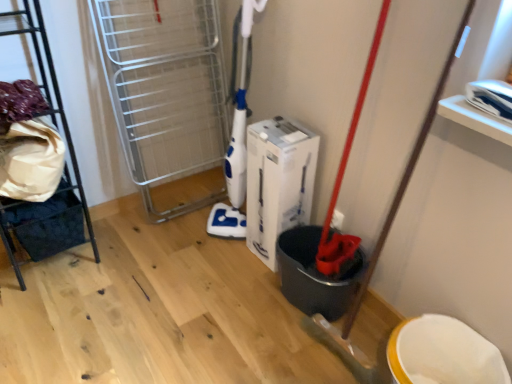
In order to click on vacant area that lies to the right of metallic black rack at left in this screenshot , I will do `click(125, 260)`.